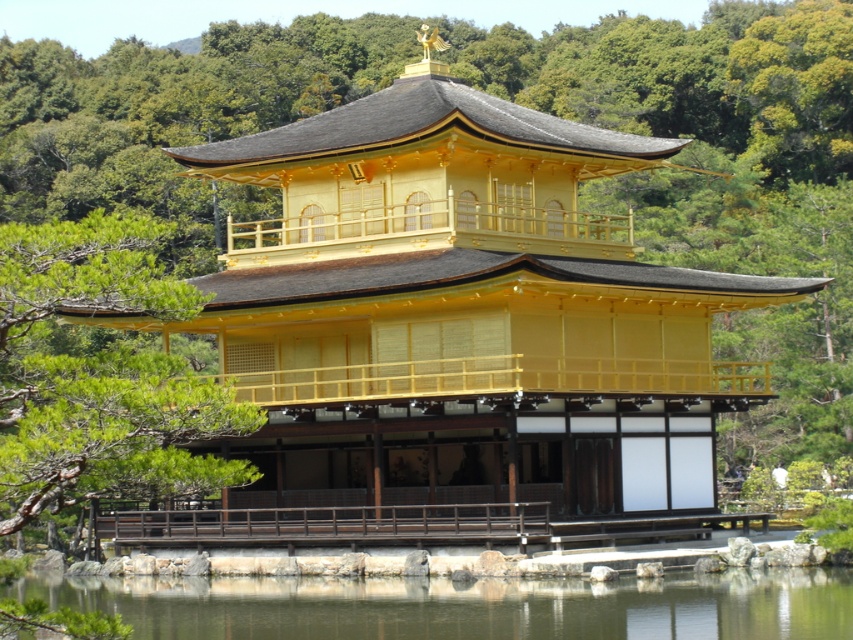
Question: Among these objects, which one is nearest to the camera?

Choices:
 (A) transparent water at lower center
 (B) green leafy tree at center

Answer: (B)

Question: Is green leafy tree at center smaller than transparent water at lower center?

Choices:
 (A) yes
 (B) no

Answer: (B)

Question: Which of the following is the farthest from the observer?

Choices:
 (A) green leafy tree at center
 (B) transparent water at lower center

Answer: (B)

Question: Is green leafy tree at center closer to the viewer compared to transparent water at lower center?

Choices:
 (A) no
 (B) yes

Answer: (B)

Question: Does green leafy tree at center lie in front of transparent water at lower center?

Choices:
 (A) no
 (B) yes

Answer: (B)

Question: Which point appears closest to the camera in this image?

Choices:
 (A) (547, 600)
 (B) (107, 289)

Answer: (B)